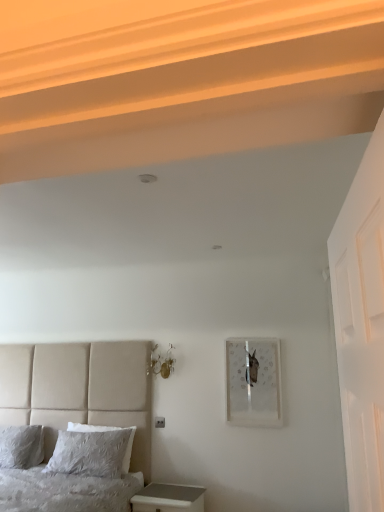
What do you see at coordinates (79, 390) in the screenshot?
I see `beige fabric bed at lower left, the first bed from the front` at bounding box center [79, 390].

This screenshot has width=384, height=512. Find the location of `beige fabric bed at lower left, the first bed from the front`. beige fabric bed at lower left, the first bed from the front is located at coordinates (79, 390).

Where is `white textured pillow at lower left, which is the second pillow from left to right`? white textured pillow at lower left, which is the second pillow from left to right is located at coordinates (90, 453).

Describe the element at coordinates (253, 382) in the screenshot. I see `matte glass picture frame at upper right` at that location.

You are a GUI agent. You are given a task and a screenshot of the screen. Output one action in this format:
    pyautogui.click(x=<x>, y=<y>)
    Task: Click on the metallic glass sconces at upper center
    The height and width of the screenshot is (512, 384).
    Given the screenshot: What is the action you would take?
    pyautogui.click(x=161, y=362)

What do you see at coordinates (73, 476) in the screenshot?
I see `textured gray pillow at lower left, the 2th bed positioned from the front` at bounding box center [73, 476].

Where is `beige fabric bed at lower left, positioned as the second bed in back-to-front order`? The image size is (384, 512). beige fabric bed at lower left, positioned as the second bed in back-to-front order is located at coordinates (79, 390).

From a real-world perspective, is white textured pillow at lower left, which is the second pillow from left to right, physically above white soft pillow at lower left, which is the 1th pillow in left-to-right order?

No.

Is white textured pillow at lower left, which is the second pillow from left to right, not close to white soft pillow at lower left, which is the 1th pillow in left-to-right order?

They are positioned close to each other.

Which of these two, white textured pillow at lower left, which is the 1th pillow from right to left, or white soft pillow at lower left, which is the 1th pillow in left-to-right order, is thinner?

Thinner between the two is white textured pillow at lower left, which is the 1th pillow from right to left.

Which is correct: white textured pillow at lower left, which is the second pillow from left to right, is inside white soft pillow at lower left, the second pillow when ordered from right to left, or outside of it?

white textured pillow at lower left, which is the second pillow from left to right, is spatially situated outside white soft pillow at lower left, the second pillow when ordered from right to left.

Is point (248, 359) more distant than point (124, 410)?

No, (248, 359) is closer to viewer.

Does matte glass picture frame at upper right contain beige fabric bed at lower left, positioned as the second bed in back-to-front order?

No, beige fabric bed at lower left, positioned as the second bed in back-to-front order, is not a part of matte glass picture frame at upper right.

Could you measure the distance between matte glass picture frame at upper right and beige fabric bed at lower left, the first bed from the front?

The distance of matte glass picture frame at upper right from beige fabric bed at lower left, the first bed from the front, is 3.96 feet.

Is matte glass picture frame at upper right oriented towards beige fabric bed at lower left, positioned as the second bed in back-to-front order?

No, matte glass picture frame at upper right is not aimed at beige fabric bed at lower left, positioned as the second bed in back-to-front order.

Would you say beige fabric bed at lower left, the first bed from the front, is to the left or to the right of metallic glass sconces at upper center in the picture?

From the image, it's evident that beige fabric bed at lower left, the first bed from the front, is to the left of metallic glass sconces at upper center.

Consider the image. Is beige fabric bed at lower left, the first bed from the front, far away from metallic glass sconces at upper center?

beige fabric bed at lower left, the first bed from the front, is near metallic glass sconces at upper center, not far away.

From a real-world perspective, does beige fabric bed at lower left, the first bed from the front, sit lower than metallic glass sconces at upper center?

Yes.

Identify the location of light fixture behind the beige fabric bed at lower left, positioned as the second bed in back-to-front order. (161, 362).

How far apart are white soft pillow at lower left, the second pillow when ordered from right to left, and white glossy nightstand at lower left?

white soft pillow at lower left, the second pillow when ordered from right to left, is 1.27 meters from white glossy nightstand at lower left.

Find the location of a particular element. the 2nd pillow counting from the left side of the white glossy nightstand at lower left is located at coordinates (21, 446).

In the scene shown: From a real-world perspective, is white soft pillow at lower left, the second pillow when ordered from right to left, on top of white glossy nightstand at lower left?

Yes, from a real-world perspective, white soft pillow at lower left, the second pillow when ordered from right to left, is over white glossy nightstand at lower left

Would you say white textured pillow at lower left, which is the 1th pillow from right to left, is outside beige fabric bed at lower left, the first bed from the front?

No, white textured pillow at lower left, which is the 1th pillow from right to left, is inside beige fabric bed at lower left, the first bed from the front,'s boundary.

How different are the orientations of white textured pillow at lower left, which is the second pillow from left to right, and beige fabric bed at lower left, positioned as the second bed in back-to-front order, in degrees?

There is a 1.22-degree angle between the facing directions of white textured pillow at lower left, which is the second pillow from left to right, and beige fabric bed at lower left, positioned as the second bed in back-to-front order.

Which object is positioned more to the right, white textured pillow at lower left, which is the second pillow from left to right, or beige fabric bed at lower left, positioned as the second bed in back-to-front order?

From the viewer's perspective, white textured pillow at lower left, which is the second pillow from left to right, appears more on the right side.

How distant is white textured pillow at lower left, which is the 1th pillow from right to left, from beige fabric bed at lower left, the first bed from the front?

white textured pillow at lower left, which is the 1th pillow from right to left, and beige fabric bed at lower left, the first bed from the front, are 18.96 inches apart from each other.

The width and height of the screenshot is (384, 512). In order to click on light fixture that is above the white textured pillow at lower left, which is the 1th pillow from right to left (from the image's perspective) in this screenshot , I will do (x=161, y=362).

Could you measure the distance between metallic glass sconces at upper center and white textured pillow at lower left, which is the second pillow from left to right?

metallic glass sconces at upper center is 81.11 centimeters from white textured pillow at lower left, which is the second pillow from left to right.

Considering the relative positions of metallic glass sconces at upper center and white textured pillow at lower left, which is the 1th pillow from right to left, in the image provided, is metallic glass sconces at upper center behind white textured pillow at lower left, which is the 1th pillow from right to left,?

Yes, it is behind white textured pillow at lower left, which is the 1th pillow from right to left.

Is metallic glass sconces at upper center to the left or to the right of white textured pillow at lower left, which is the 1th pillow from right to left, in the image?

Clearly, metallic glass sconces at upper center is on the right of white textured pillow at lower left, which is the 1th pillow from right to left, in the image.

The height and width of the screenshot is (512, 384). What are the coordinates of `picture frame above the textured gray pillow at lower left, the 2th bed positioned from the front (from the image's perspective)` in the screenshot? It's located at (253, 382).

In terms of width, does matte glass picture frame at upper right look wider or thinner when compared to textured gray pillow at lower left, which is the 1th bed from back to front?

matte glass picture frame at upper right is thinner than textured gray pillow at lower left, which is the 1th bed from back to front.

Is matte glass picture frame at upper right placed right next to textured gray pillow at lower left, the 2th bed positioned from the front?

No, matte glass picture frame at upper right is not touching textured gray pillow at lower left, the 2th bed positioned from the front.

Image resolution: width=384 pixels, height=512 pixels. There is a white textured pillow at lower left, which is the 1th pillow from right to left. Find the location of `pillow above it (from a real-world perspective)`. pillow above it (from a real-world perspective) is located at coordinates (21, 446).

Locate an element on the screen. This screenshot has height=512, width=384. the 1st bed directly beneath the matte glass picture frame at upper right (from a real-world perspective) is located at coordinates (79, 390).

Looking at the image, which one is located further to matte glass picture frame at upper right, metallic glass sconces at upper center or textured gray pillow at lower left, which is the 1th bed from back to front?

textured gray pillow at lower left, which is the 1th bed from back to front.

Based on their spatial positions, is beige fabric bed at lower left, positioned as the second bed in back-to-front order, or textured gray pillow at lower left, which is the 1th bed from back to front, closer to white soft pillow at lower left, the second pillow when ordered from right to left?

Based on the image, beige fabric bed at lower left, positioned as the second bed in back-to-front order, appears to be nearer to white soft pillow at lower left, the second pillow when ordered from right to left.

Considering their positions, is white textured pillow at lower left, which is the second pillow from left to right, positioned further to white soft pillow at lower left, the second pillow when ordered from right to left, than beige fabric bed at lower left, positioned as the second bed in back-to-front order?

Among the two, white textured pillow at lower left, which is the second pillow from left to right, is located further to white soft pillow at lower left, the second pillow when ordered from right to left.

Based on the photo, from the image, which object appears to be nearer to white soft pillow at lower left, the second pillow when ordered from right to left, white glossy nightstand at lower left or metallic glass sconces at upper center?

Based on the image, white glossy nightstand at lower left appears to be nearer to white soft pillow at lower left, the second pillow when ordered from right to left.

From the image, which object appears to be nearer to matte glass picture frame at upper right, metallic glass sconces at upper center or white textured pillow at lower left, which is the second pillow from left to right?

Based on the image, metallic glass sconces at upper center appears to be nearer to matte glass picture frame at upper right.

Estimate the real-world distances between objects in this image. Which object is further from beige fabric bed at lower left, the first bed from the front, matte glass picture frame at upper right or white glossy nightstand at lower left?

matte glass picture frame at upper right is positioned further to the anchor beige fabric bed at lower left, the first bed from the front.

Estimate the real-world distances between objects in this image. Which object is closer to textured gray pillow at lower left, which is the 1th bed from back to front, white soft pillow at lower left, which is the 1th pillow in left-to-right order, or beige fabric bed at lower left, positioned as the second bed in back-to-front order?

beige fabric bed at lower left, positioned as the second bed in back-to-front order, is closer to textured gray pillow at lower left, which is the 1th bed from back to front.

Considering their positions, is beige fabric bed at lower left, positioned as the second bed in back-to-front order, positioned closer to matte glass picture frame at upper right than white glossy nightstand at lower left?

white glossy nightstand at lower left.

Where is `light fixture located between white textured pillow at lower left, which is the second pillow from left to right, and matte glass picture frame at upper right in the left-right direction`? Image resolution: width=384 pixels, height=512 pixels. light fixture located between white textured pillow at lower left, which is the second pillow from left to right, and matte glass picture frame at upper right in the left-right direction is located at coordinates (161, 362).

Identify the location of bed located between beige fabric bed at lower left, positioned as the second bed in back-to-front order, and matte glass picture frame at upper right in the depth direction. The width and height of the screenshot is (384, 512). (73, 476).

Where is `light fixture situated between white soft pillow at lower left, which is the 1th pillow in left-to-right order, and white glossy nightstand at lower left from left to right`? This screenshot has width=384, height=512. light fixture situated between white soft pillow at lower left, which is the 1th pillow in left-to-right order, and white glossy nightstand at lower left from left to right is located at coordinates (161, 362).

Image resolution: width=384 pixels, height=512 pixels. I want to click on picture frame between metallic glass sconces at upper center and white glossy nightstand at lower left in the vertical direction, so click(253, 382).